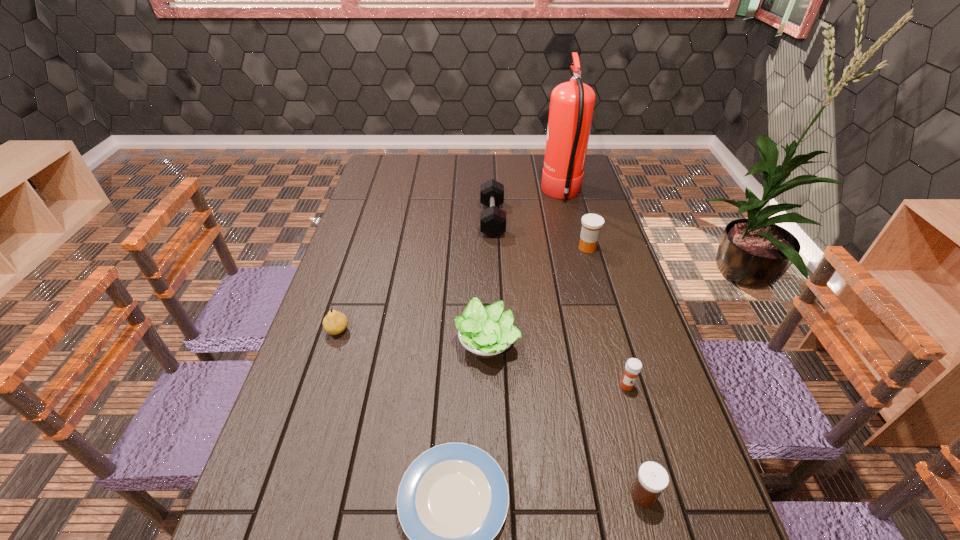
Where is `fire extinguisher`? The width and height of the screenshot is (960, 540). fire extinguisher is located at coordinates (572, 103).

Image resolution: width=960 pixels, height=540 pixels. Identify the location of the tallest medicine. (591, 223).

Where is `the sixth nearest object`? The image size is (960, 540). the sixth nearest object is located at coordinates coord(591,223).

The width and height of the screenshot is (960, 540). I want to click on dumbbell, so click(492, 220).

In order to click on the leftmost object in this screenshot , I will do `click(334, 323)`.

Locate an element on the screen. lettuce is located at coordinates (486, 333).

Where is `the third nearest object`? the third nearest object is located at coordinates (633, 366).

The width and height of the screenshot is (960, 540). I want to click on the nearest medicine, so click(652, 479).

This screenshot has height=540, width=960. Identify the location of free point located towards the nozzle of the fire extinguisher. (514, 195).

What are the coordinates of `vacant space located 0.280m towards the nozzle of the fire extinguisher` in the screenshot? It's located at (469, 195).